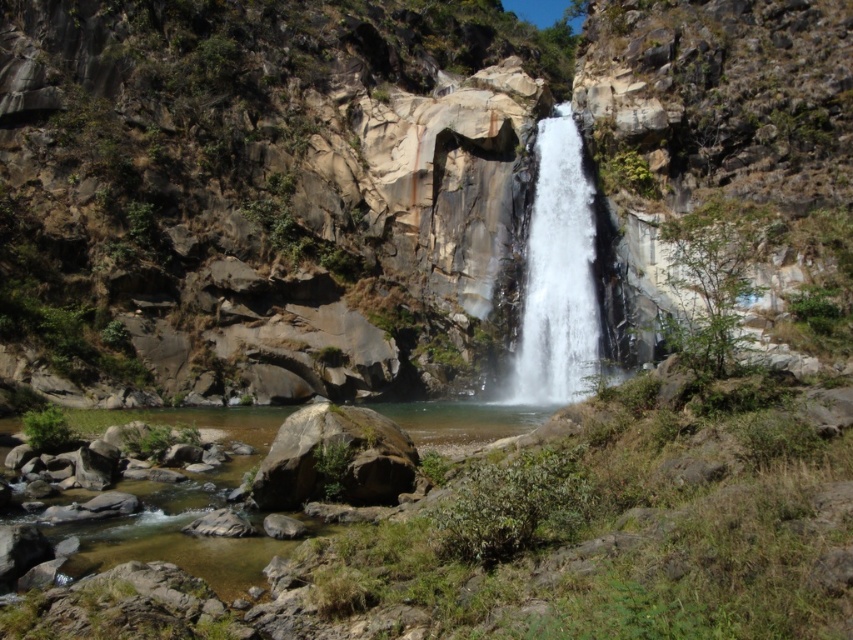
Question: Which of the following is the closest to the observer?

Choices:
 (A) white smooth waterfall at center
 (B) green mossy rock at center

Answer: (B)

Question: In this image, where is white smooth waterfall at center located relative to green mossy rock at center?

Choices:
 (A) left
 (B) right

Answer: (B)

Question: Is white smooth waterfall at center wider than green mossy rock at center?

Choices:
 (A) no
 (B) yes

Answer: (A)

Question: Can you confirm if white smooth waterfall at center is smaller than green mossy rock at center?

Choices:
 (A) yes
 (B) no

Answer: (B)